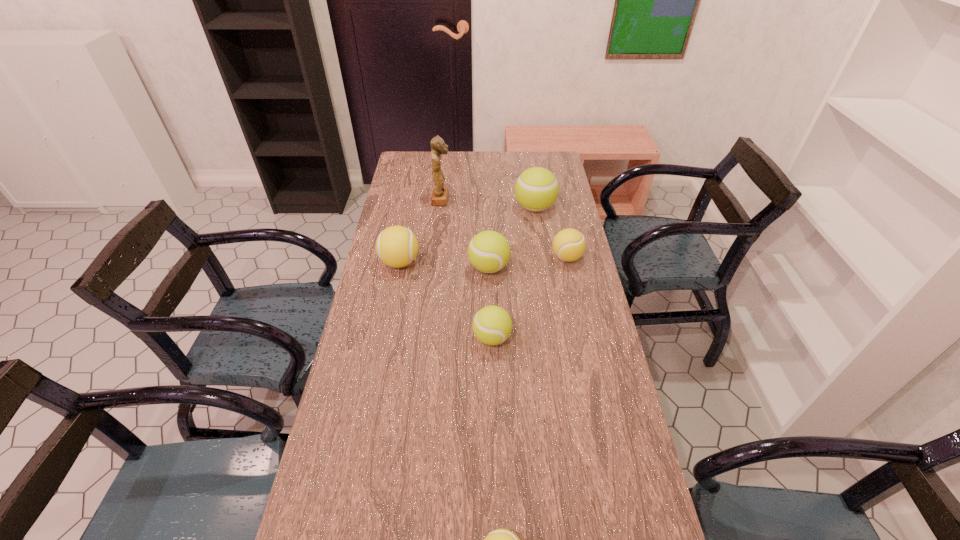
Find the location of `vacant space located on the front-facing side of the tallest object`. vacant space located on the front-facing side of the tallest object is located at coordinates (509, 200).

This screenshot has width=960, height=540. I want to click on vacant space located 0.170m on the back of the rightmost green tennis ball, so (x=530, y=175).

The height and width of the screenshot is (540, 960). I want to click on free region located 0.240m on the back of the second nearest green tennis ball, so click(488, 216).

Image resolution: width=960 pixels, height=540 pixels. I want to click on vacant space located 0.050m on the back of the leftmost object, so click(404, 241).

Where is `free region located 0.120m on the left of the rightmost yellow tennis ball`? This screenshot has height=540, width=960. free region located 0.120m on the left of the rightmost yellow tennis ball is located at coordinates (518, 258).

This screenshot has width=960, height=540. I want to click on vacant area located on the front of the nearest green tennis ball, so click(x=493, y=402).

Find the location of a particular element. object located at the left edge is located at coordinates (396, 246).

Image resolution: width=960 pixels, height=540 pixels. Identify the location of free spot at the far edge of the desktop. (480, 168).

This screenshot has height=540, width=960. What are the coordinates of `vacant area at the left edge of the desktop` in the screenshot? It's located at (364, 464).

The width and height of the screenshot is (960, 540). I want to click on free spot at the right edge of the desktop, so click(x=574, y=314).